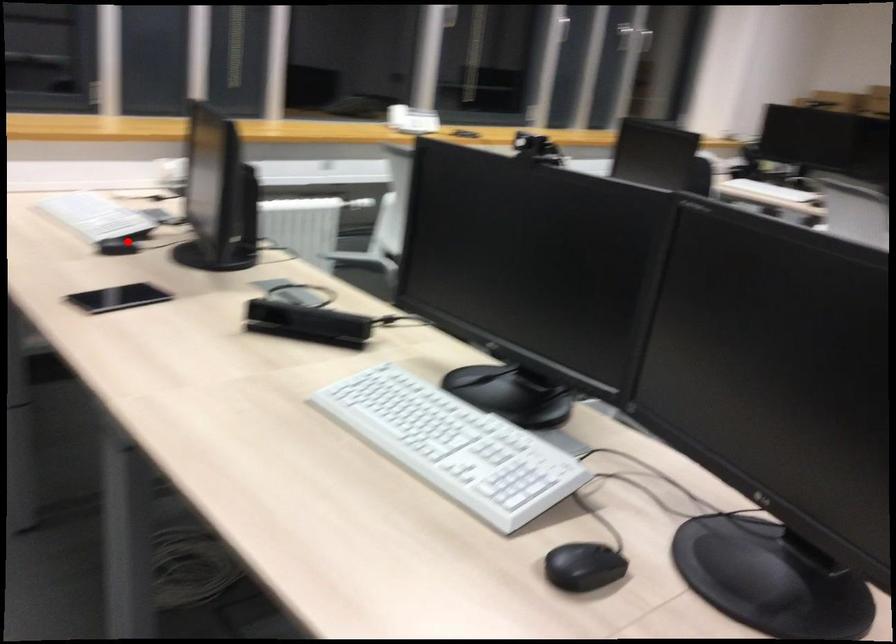
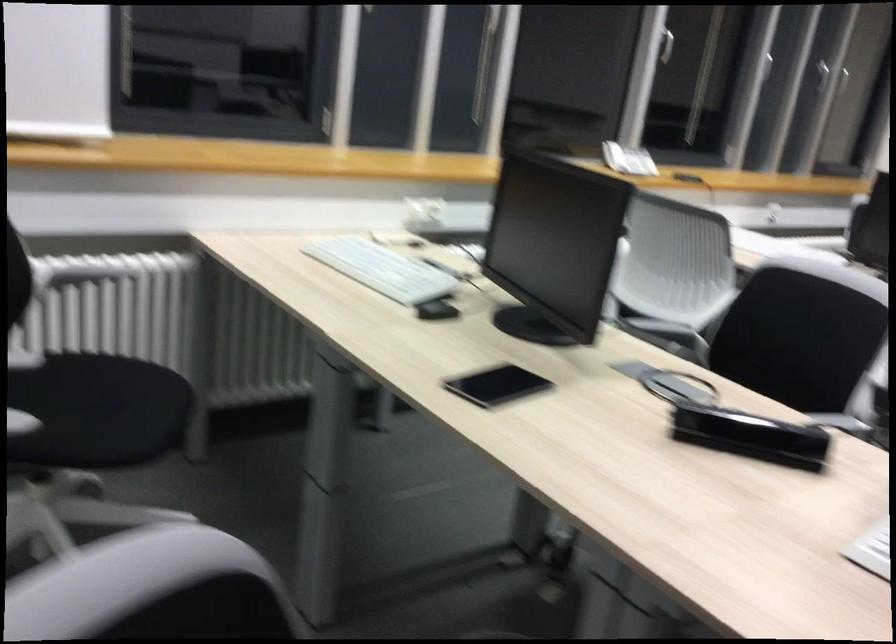
Question: I am providing you with two images of the same scene from different viewpoints. In image1, a red point is highlighted. Considering the same 3D point in image2, which of the following is correct?

Choices:
 (A) It is closer
 (B) It is farther

Answer: (A)